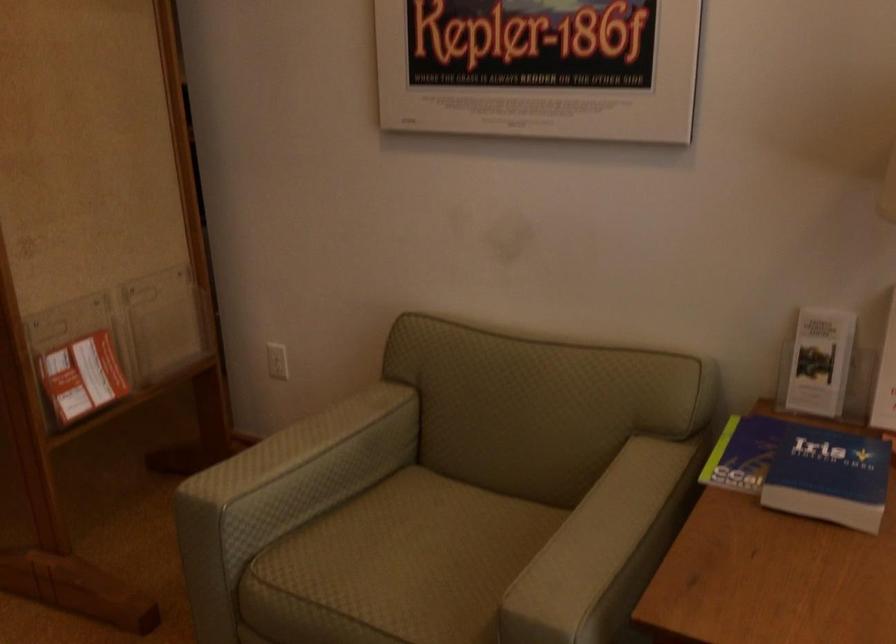
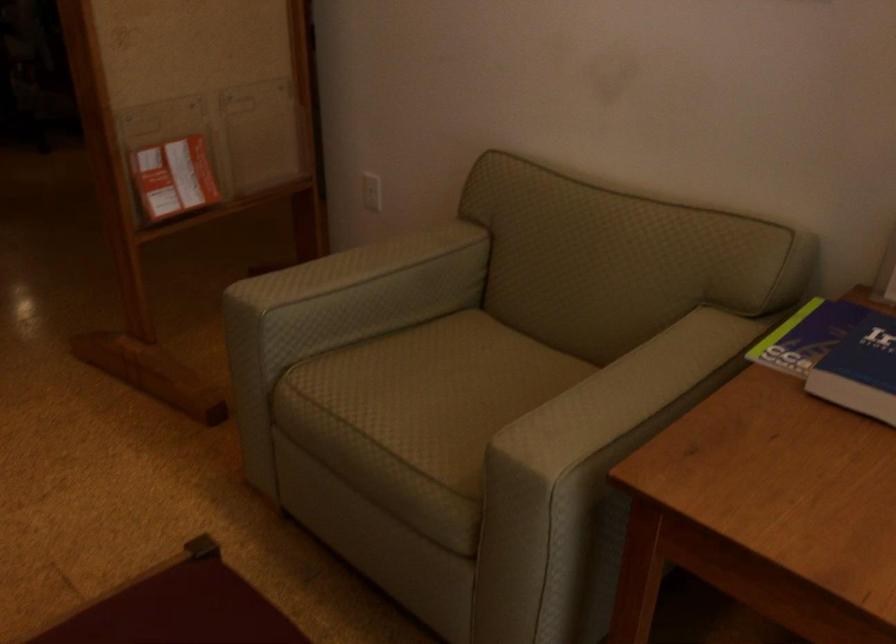
Which direction would the cameraman need to move to produce the second image?

The cameraman moved toward right, forward.